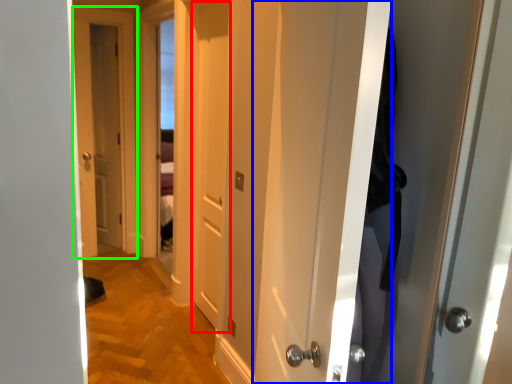
Question: Which is nearer to the door (highlighted by a red box)? door (highlighted by a blue box) or door (highlighted by a green box).

Choices:
 (A) door
 (B) door

Answer: (A)